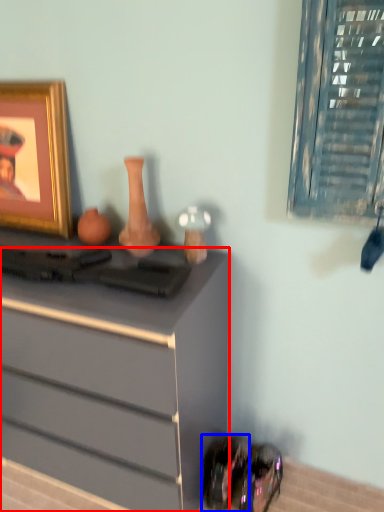
Question: Which object is closer to the camera taking this photo, chest of drawers (highlighted by a red box) or shoe (highlighted by a blue box)?

Choices:
 (A) chest of drawers
 (B) shoe

Answer: (A)